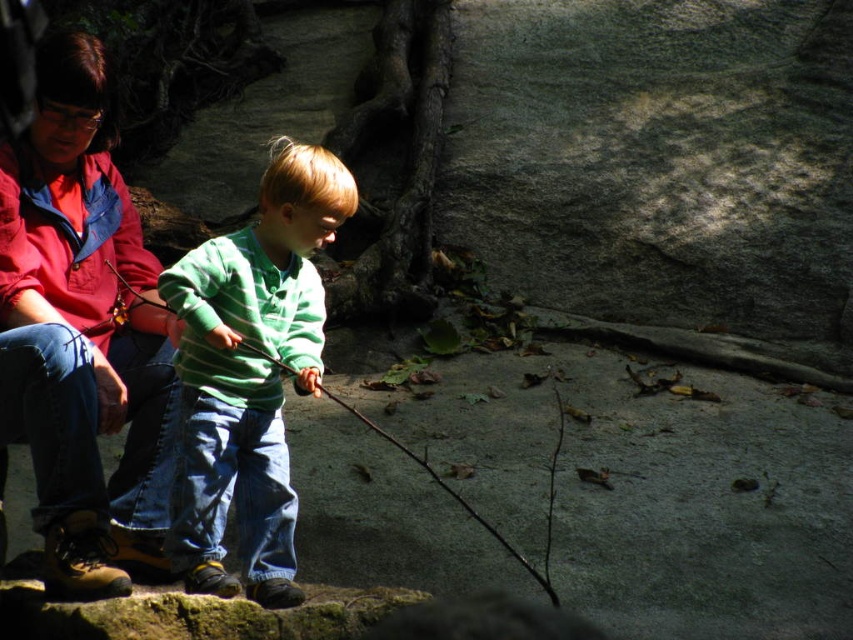
Is green striped sweater at center closer to camera compared to wooden stick at center?

No, green striped sweater at center is behind wooden stick at center.

Who is higher up, green striped sweater at center or wooden stick at center?

green striped sweater at center is higher up.

Is point (192, 392) positioned after point (422, 467)?

That is False.

Find the location of `green striped sweater at center`. green striped sweater at center is located at coordinates (250, 372).

Between red cotton shirt at upper left and wooden stick at center, which one appears on the right side from the viewer's perspective?

wooden stick at center

Can you confirm if red cotton shirt at upper left is thinner than wooden stick at center?

Correct, red cotton shirt at upper left's width is less than wooden stick at center's.

The width and height of the screenshot is (853, 640). In order to click on red cotton shirt at upper left in this screenshot , I will do `click(80, 332)`.

Looking at this image, does red cotton shirt at upper left appear on the left side of green striped sweater at center?

Indeed, red cotton shirt at upper left is positioned on the left side of green striped sweater at center.

Is point (115, 372) farther from camera compared to point (316, 278)?

That is True.

From the picture: Measure the distance between point (45, 259) and camera.

Point (45, 259) is 9.69 feet from camera.

Where is `red cotton shirt at upper left`? Image resolution: width=853 pixels, height=640 pixels. red cotton shirt at upper left is located at coordinates (80, 332).